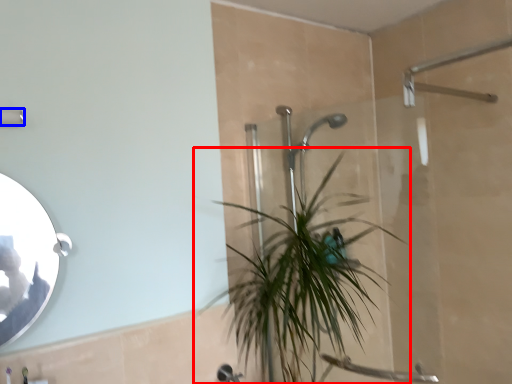
Question: Among these objects, which one is nearest to the camera, houseplant (highlighted by a red box) or shower (highlighted by a blue box)?

Choices:
 (A) houseplant
 (B) shower

Answer: (B)